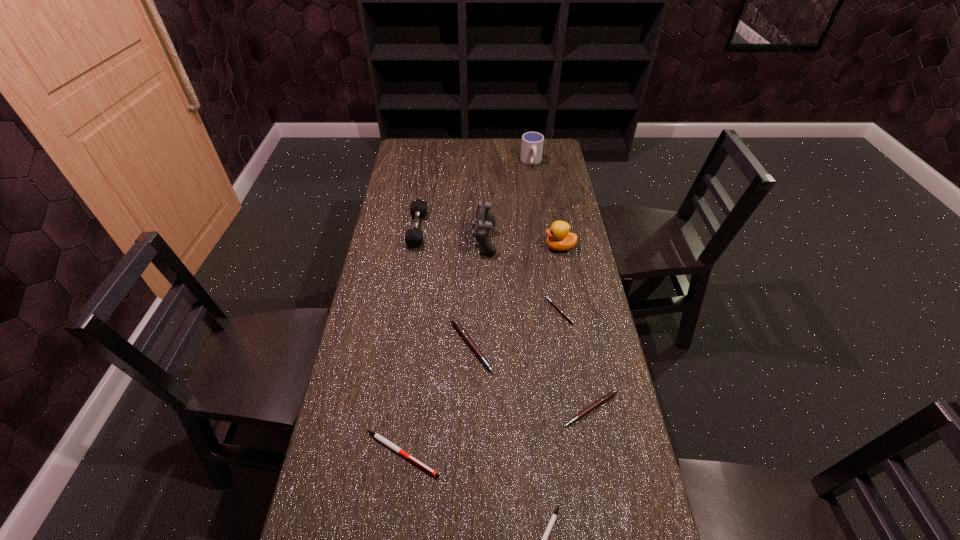
In order to click on vacant space that satisfies the following two spatial constraints: 1. with the handle on the side of the farthest object; 2. at the nib of the tallest pen in this screenshot , I will do `click(559, 346)`.

Find the location of a particular element. This screenshot has width=960, height=540. vacant space that satisfies the following two spatial constraints: 1. with the handle on the side of the farthest object; 2. on the clicker of the fourth farthest pen is located at coordinates (575, 454).